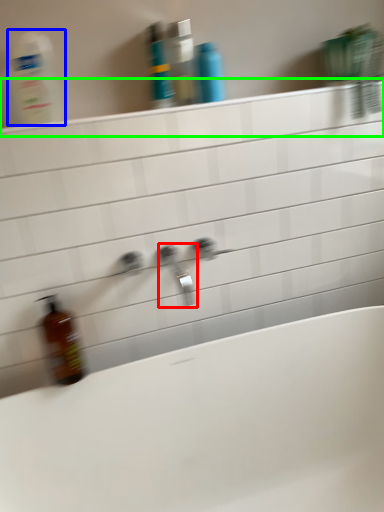
Question: Which is nearer to the tap (highlighted by a red box)? cleaning product (highlighted by a blue box) or ledge (highlighted by a green box).

Choices:
 (A) cleaning product
 (B) ledge

Answer: (B)